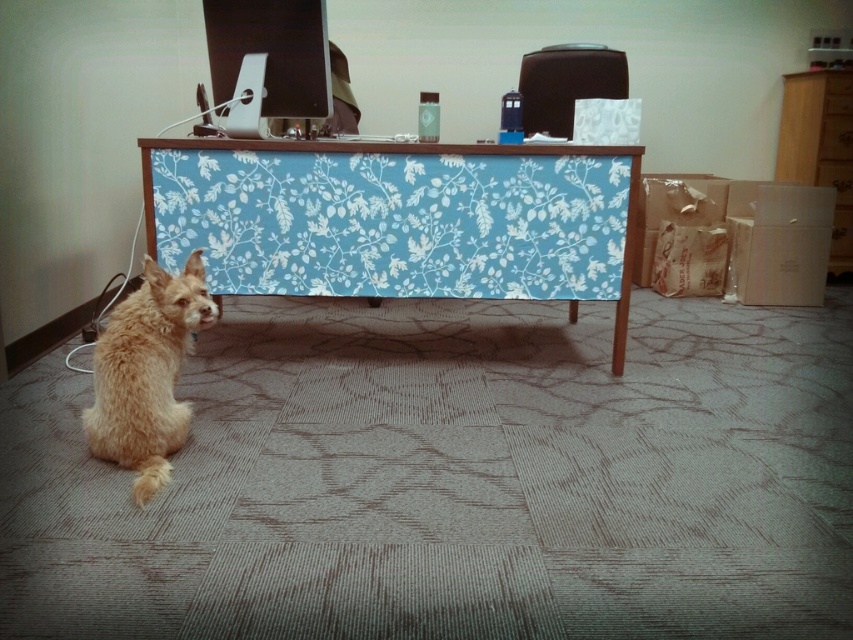
Question: Does blue fabric-covered desk at center have a smaller size compared to fuzzy golden dog at lower left?

Choices:
 (A) yes
 (B) no

Answer: (B)

Question: Which of these objects is positioned closest to the blue fabric-covered desk at center?

Choices:
 (A) metallic silver monitor at upper center
 (B) fuzzy golden dog at lower left
 (C) brown wood dresser at upper right
 (D) matte black speaker at upper center

Answer: (A)

Question: Can you confirm if fuzzy golden dog at lower left is wider than matte black speaker at upper center?

Choices:
 (A) yes
 (B) no

Answer: (A)

Question: Does brown wood dresser at upper right appear on the right side of matte black speaker at upper center?

Choices:
 (A) yes
 (B) no

Answer: (A)

Question: Which object appears farthest from the camera in this image?

Choices:
 (A) metallic silver monitor at upper center
 (B) blue fabric-covered desk at center
 (C) fuzzy golden dog at lower left
 (D) matte black speaker at upper center

Answer: (D)

Question: Among these objects, which one is nearest to the camera?

Choices:
 (A) fuzzy golden dog at lower left
 (B) brown wood dresser at upper right
 (C) metallic silver monitor at upper center
 (D) matte black speaker at upper center

Answer: (A)